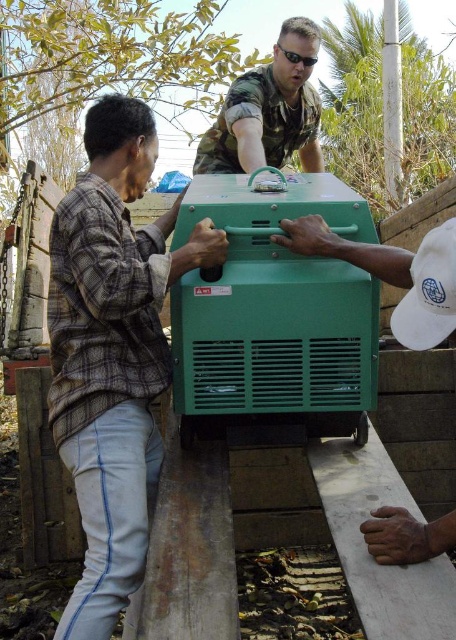
Between green plastic generator at center and camouflage fabric uniform at upper center, which one appears on the left side from the viewer's perspective?

Positioned to the left is camouflage fabric uniform at upper center.

Does green plastic generator at center have a greater width compared to camouflage fabric uniform at upper center?

No, green plastic generator at center is not wider than camouflage fabric uniform at upper center.

The image size is (456, 640). What do you see at coordinates (274, 316) in the screenshot?
I see `green plastic generator at center` at bounding box center [274, 316].

Locate an element on the screen. green plastic generator at center is located at coordinates (274, 316).

Does point (124, 474) come farther from viewer compared to point (317, 336)?

No, (124, 474) is closer to viewer.

Does plaid fabric shirt at left appear on the left side of green plastic generator at center?

Yes, plaid fabric shirt at left is to the left of green plastic generator at center.

Is point (102, 486) closer to viewer compared to point (352, 333)?

That is True.

This screenshot has height=640, width=456. Find the location of `plaid fabric shirt at left`. plaid fabric shirt at left is located at coordinates (113, 353).

From the picture: Is plaid fabric shirt at left below camouflage fabric uniform at upper center?

Indeed, plaid fabric shirt at left is positioned under camouflage fabric uniform at upper center.

Is plaid fabric shirt at left closer to the viewer compared to camouflage fabric uniform at upper center?

Yes, it is.

Between point (139, 552) and point (226, 100), which one is positioned in front?

Positioned in front is point (139, 552).

Image resolution: width=456 pixels, height=640 pixels. I want to click on plaid fabric shirt at left, so click(x=113, y=353).